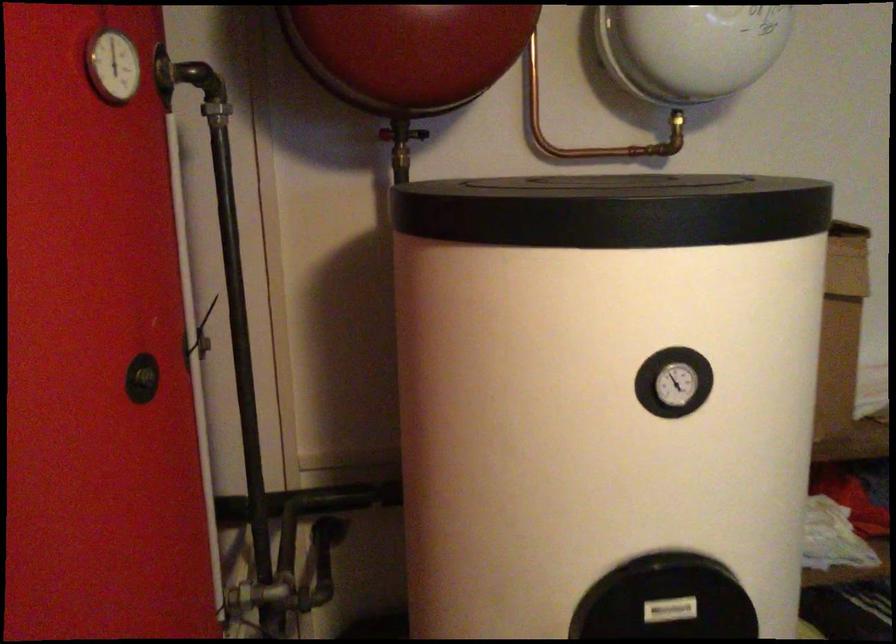
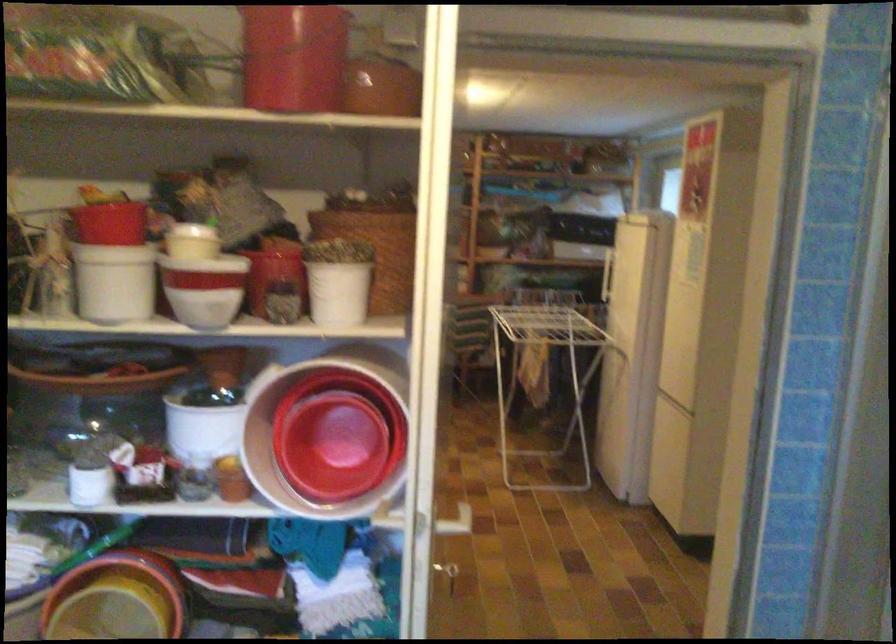
Question: I am providing you with two images of the same scene from different viewpoints. After the viewpoint changes to image2, which objects are now occluded?

Choices:
 (A) white and red bowl
 (B) black door handle
 (C) tangled black wires
 (D) white plastic bucket

Answer: (B)